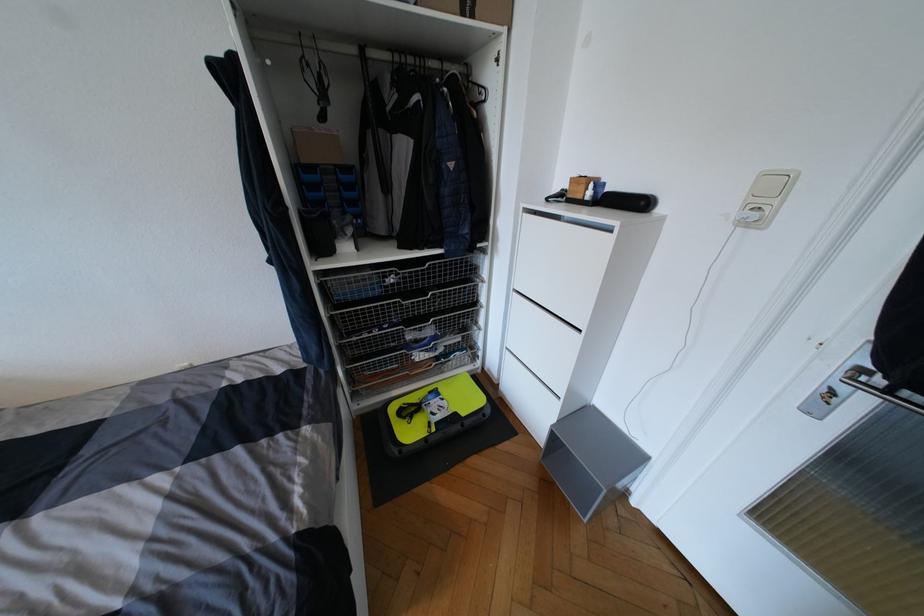
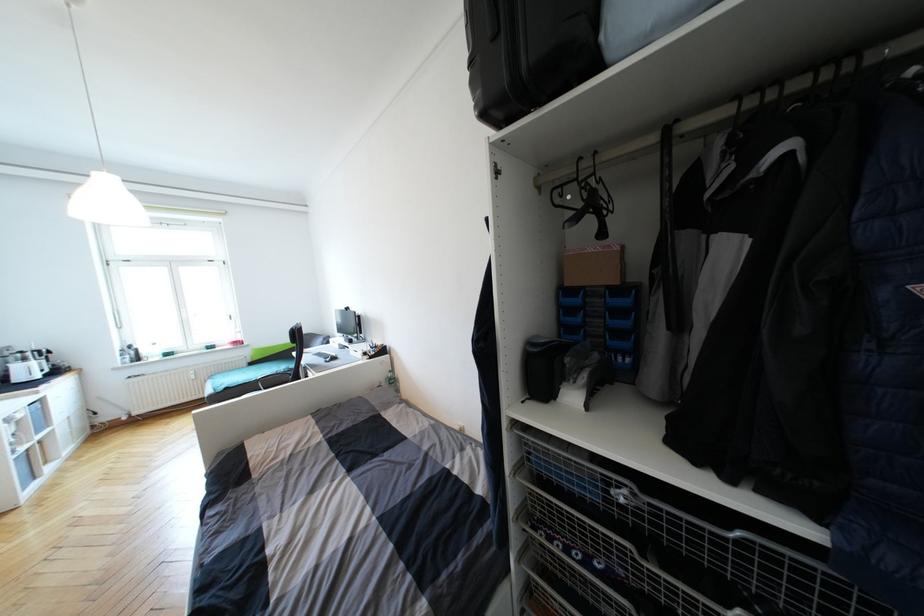
Question: Based on the continuous images, in which direction is the camera rotating? Reply with the corresponding letter.

Choices:
 (A) Left
 (B) Right
 (C) Up
 (D) Down

Answer: (A)